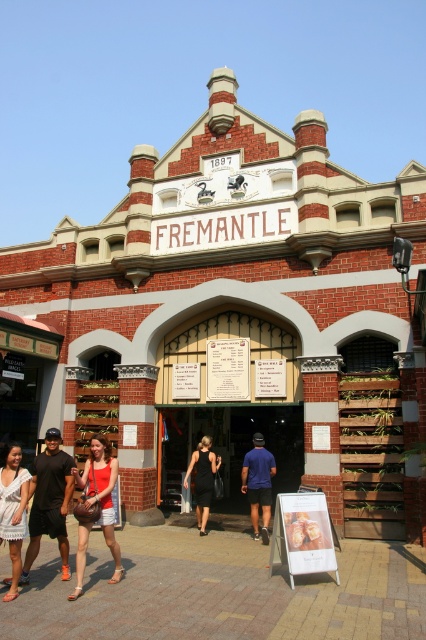
Is point (290, 420) positioned after point (103, 534)?

Yes, it is behind point (103, 534).

Is black glass door at center shorter than matte red tank top at center?

No, black glass door at center is not shorter than matte red tank top at center.

At what (x,y) coordinates should I click in order to perform the action: click on black glass door at center. Please return your answer as a coordinate pair (x, y). Looking at the image, I should click on (230, 445).

Is black glass door at center to the left of matte black shorts at lower left from the viewer's perspective?

In fact, black glass door at center is to the right of matte black shorts at lower left.

Describe the element at coordinates (230, 445) in the screenshot. I see `black glass door at center` at that location.

What are the coordinates of `black glass door at center` in the screenshot? It's located at (230, 445).

Does matte red tank top at center have a lesser width compared to blue fabric shirt at center?

Yes.

Between matte red tank top at center and blue fabric shirt at center, which one has more height?

Standing taller between the two is blue fabric shirt at center.

Is point (101, 452) positioned after point (255, 531)?

No, it is in front of (255, 531).

At what (x,y) coordinates should I click in order to perform the action: click on matte red tank top at center. Please return your answer as a coordinate pair (x, y). This screenshot has height=640, width=426. Looking at the image, I should click on (97, 506).